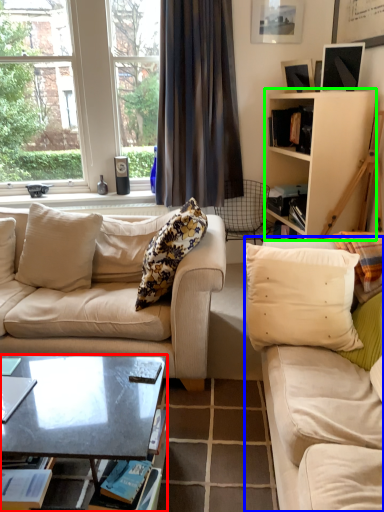
Question: Based on their relative distances, which object is nearer to coffee table (highlighted by a red box)? Choose from studio couch (highlighted by a blue box) and cabinetry (highlighted by a green box).

Choices:
 (A) studio couch
 (B) cabinetry

Answer: (A)